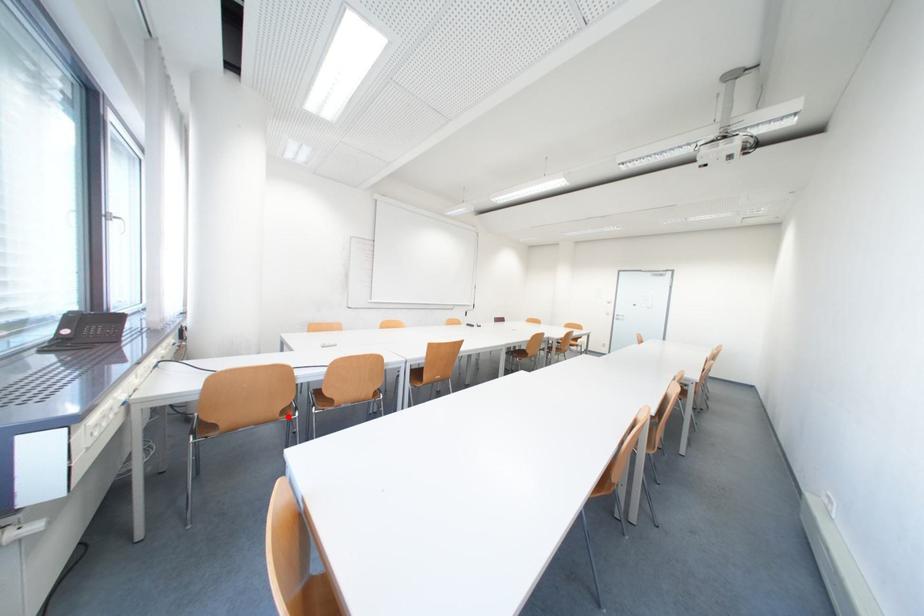
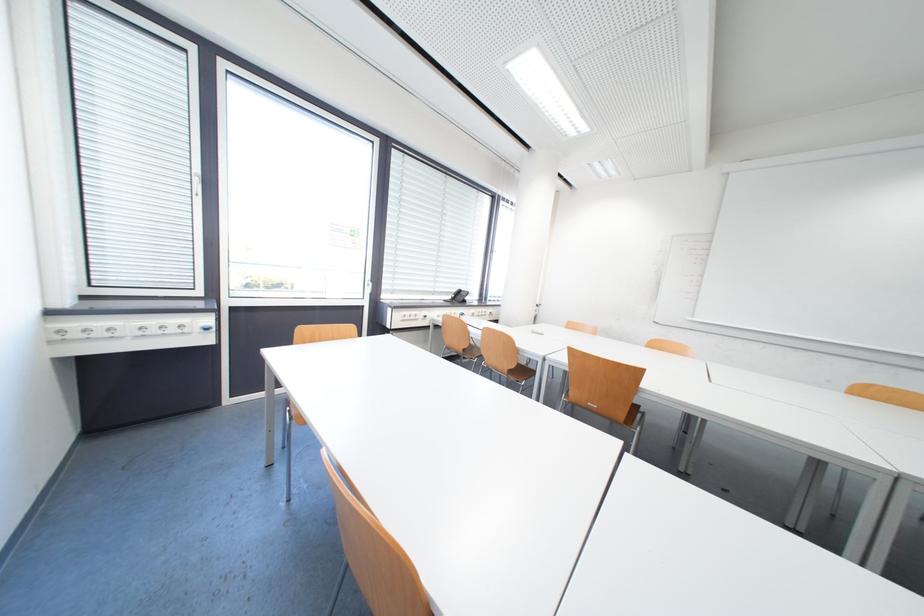
Locate, in the second image, the point that corresponds to the highlighted location in the first image.

(471, 352)